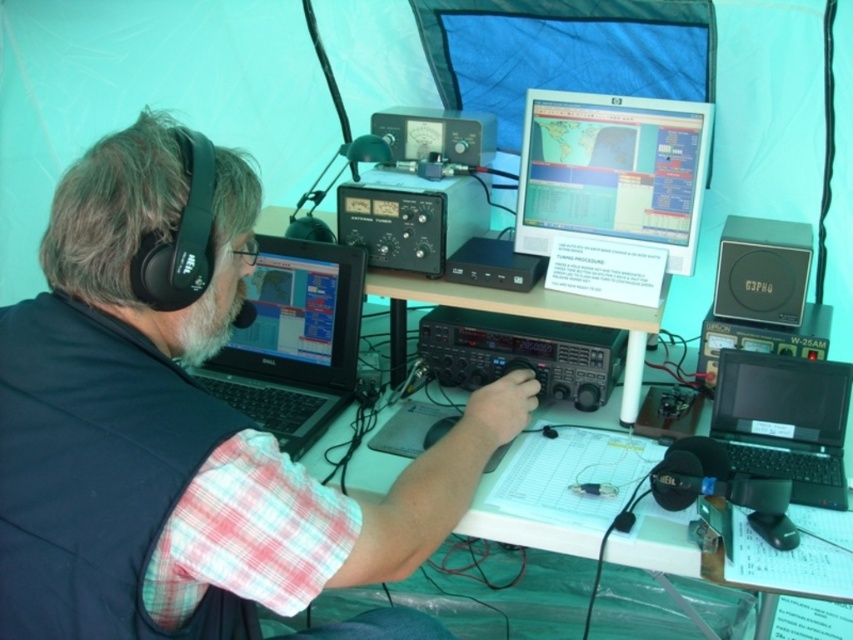
Is point (567, 212) positioned after point (426, 282)?

No, (567, 212) is closer to viewer.

Does matte plastic monitor at center have a lesser height compared to white plastic table at center?

No.

Which is in front, point (659, 180) or point (625, 321)?

Positioned in front is point (625, 321).

Locate an element on the screen. This screenshot has height=640, width=853. matte plastic monitor at center is located at coordinates (612, 172).

Does matte plastic monitor at center have a larger size compared to black plastic laptop at right?

Yes.

Does point (583, 172) come behind point (723, 372)?

That is True.

Find the location of a particular element. The image size is (853, 640). matte plastic monitor at center is located at coordinates (612, 172).

Where is `matte plastic monitor at center`? matte plastic monitor at center is located at coordinates (612, 172).

Does matte plastic monitor at center have a greater width compared to matte black laptop at center?

In fact, matte plastic monitor at center might be narrower than matte black laptop at center.

Between matte plastic monitor at center and matte black laptop at center, which one is positioned higher?

Result: Positioned higher is matte plastic monitor at center.

Identify the location of matte plastic monitor at center. (612, 172).